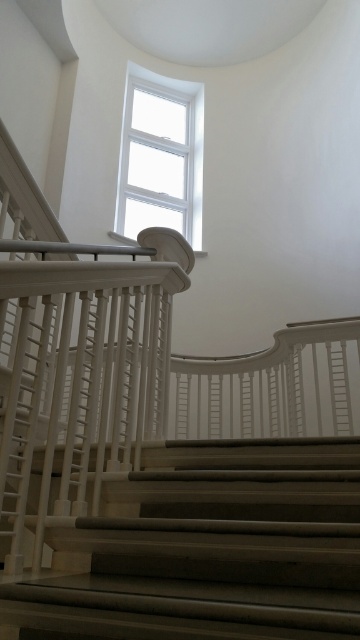
You are a delivery person holding a package that measures 3 feet in length. You are standing at the bottom of the smooth beige stairs at center and need to carry the package up the stairs. Considering the space between the stairs and the camera, can you safely navigate the stairs while carrying the package?

The distance between the smooth beige stairs at center and the camera is 3.38 feet, which is slightly more than the package length of 3 feet. Therefore, you can safely navigate the stairs while carrying the package as there is enough space.

From the picture: You are standing at the bottom of the staircase and want to look up towards the white glass window at upper center. Which direction should you turn your head to see the smooth beige stairs at center?

You should turn your head to the right to see the smooth beige stairs at center because they are to the right of the white glass window at upper center.